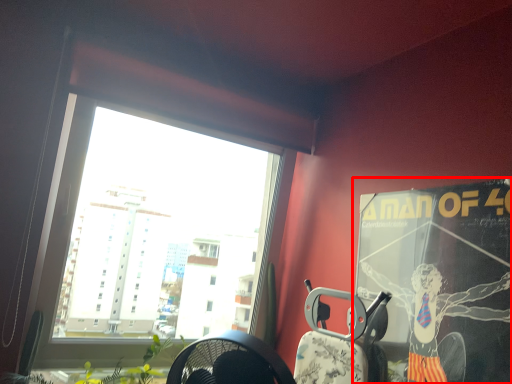
Question: From the image's perspective, where is poster page (annotated by the red box) located relative to armchair?

Choices:
 (A) below
 (B) above

Answer: (B)